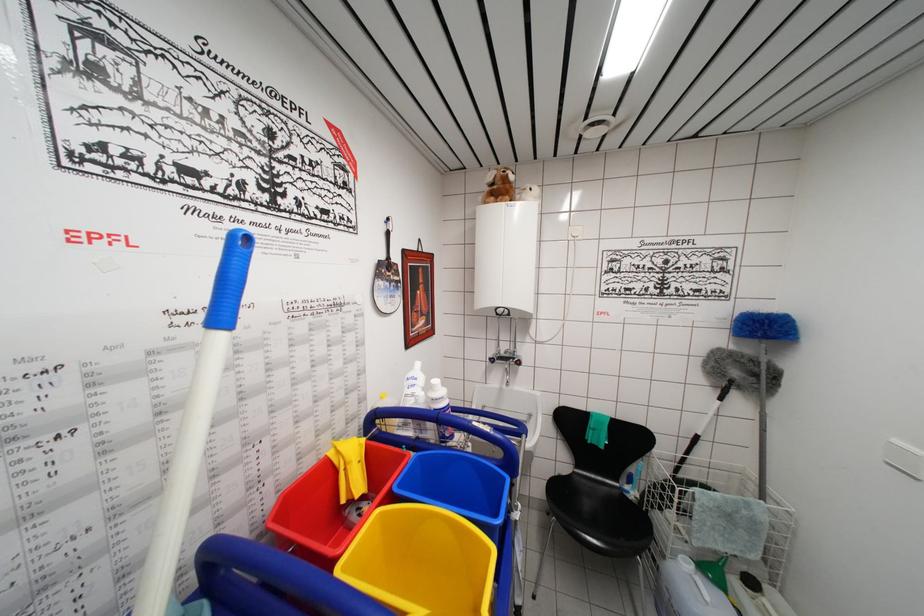
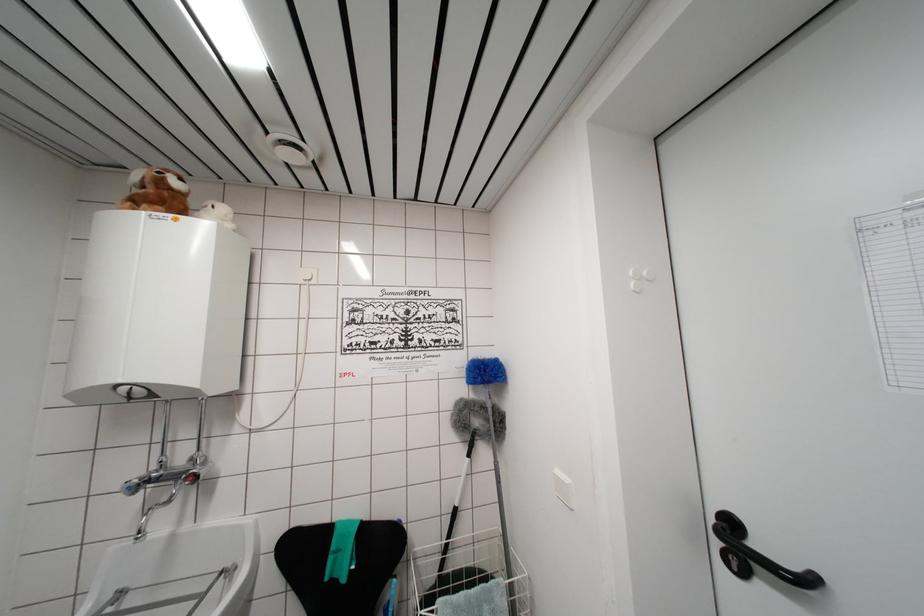
Locate, in the second image, the point that corresponds to (x=771, y=326) in the first image.

(484, 371)